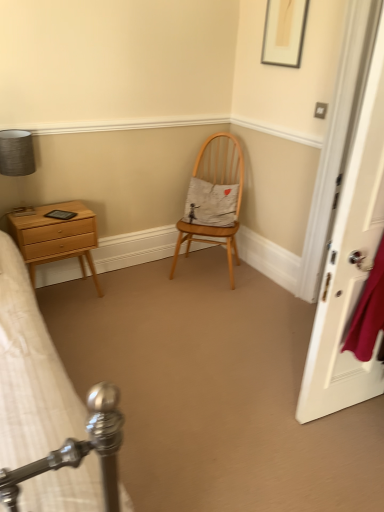
At what (x,y) coordinates should I click in order to perform the action: click on vacant space situated above matte gray lampshade at upper left (from a real-world perspective). Please return your answer as a coordinate pair (x, y). Looking at the image, I should click on (10, 133).